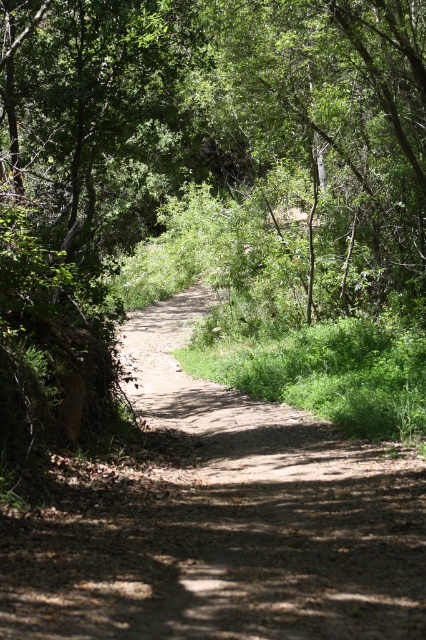
Question: Is dirt path at center behind brown dirt track at center?

Choices:
 (A) no
 (B) yes

Answer: (B)

Question: Which point is closer to the camera?

Choices:
 (A) dirt path at center
 (B) brown dirt track at center

Answer: (B)

Question: Which point appears closest to the camera in this image?

Choices:
 (A) (158, 208)
 (B) (101, 636)

Answer: (B)

Question: Is dirt path at center to the right of brown dirt track at center from the viewer's perspective?

Choices:
 (A) no
 (B) yes

Answer: (A)

Question: Which object is closer to the camera taking this photo?

Choices:
 (A) brown dirt track at center
 (B) dirt path at center

Answer: (A)

Question: Does dirt path at center appear on the right side of brown dirt track at center?

Choices:
 (A) no
 (B) yes

Answer: (A)